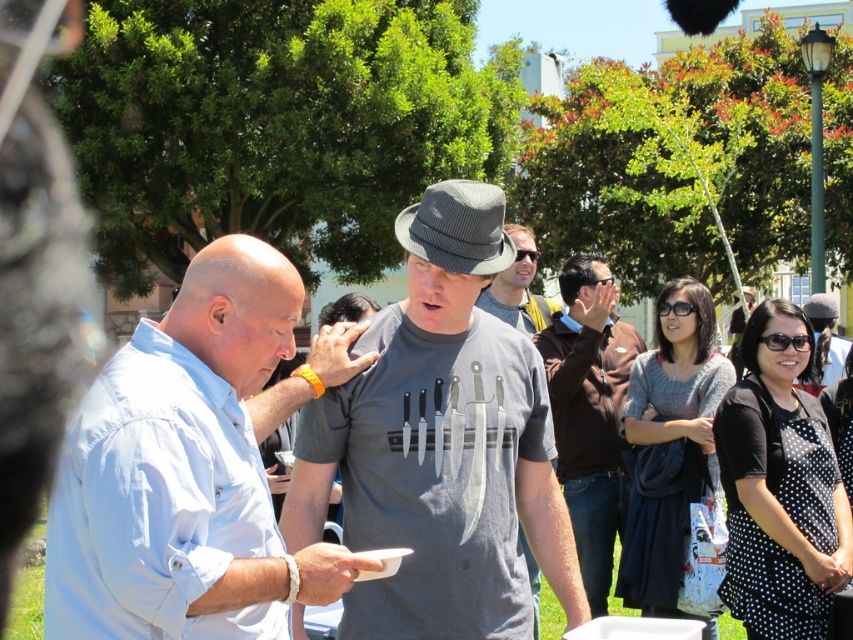
Measure the distance between gray matte hat at center and camera.

gray matte hat at center and camera are 7.31 meters apart from each other.

Does gray matte hat at center have a lesser height compared to gray matte shirt at center?

Indeed, gray matte hat at center has a lesser height compared to gray matte shirt at center.

Describe the element at coordinates (518, 288) in the screenshot. I see `gray matte hat at center` at that location.

Find the location of a particular element. The image size is (853, 640). gray matte hat at center is located at coordinates (518, 288).

Describe the element at coordinates (184, 472) in the screenshot. I see `light blue cotton shirt at center` at that location.

Is light blue cotton shirt at center further to camera compared to gray matte t-shirt at center?

That is False.

Is point (225, 568) closer to viewer compared to point (529, 260)?

Yes.

At what (x,y) coordinates should I click in order to perform the action: click on light blue cotton shirt at center. Please return your answer as a coordinate pair (x, y). Looking at the image, I should click on (184, 472).

Between gray matte t-shirt at center and gray matte shirt at center, which one has more height?

gray matte t-shirt at center is taller.

Is point (555, 310) in front of point (828, 308)?

Yes, it is in front of point (828, 308).

Does point (546, 300) come behind point (821, 324)?

No, it is not.

The width and height of the screenshot is (853, 640). I want to click on gray matte t-shirt at center, so click(518, 288).